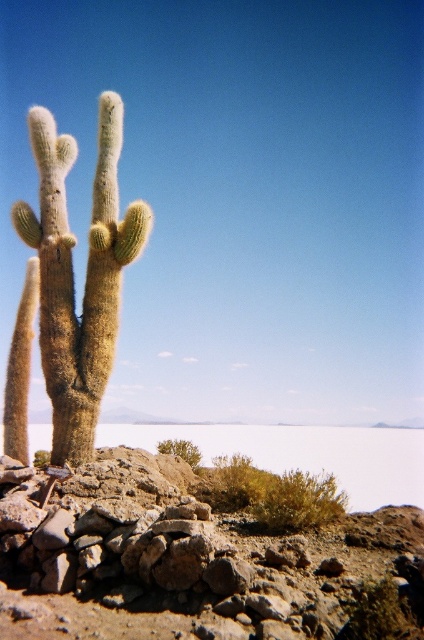
Question: Does green fuzzy cactus at left come in front of brown rocky plain at lower center?

Choices:
 (A) yes
 (B) no

Answer: (B)

Question: Among these points, which one is farthest from the camera?

Choices:
 (A) (x=284, y=426)
 (B) (x=28, y=125)

Answer: (A)

Question: Which object is farther from the camera taking this photo?

Choices:
 (A) rusty stone boulder at center
 (B) brown rocky plain at lower center
 (C) green fuzzy cactus at left

Answer: (C)

Question: Does green fuzzy cactus at left appear over brown rocky plain at lower center?

Choices:
 (A) no
 (B) yes

Answer: (B)

Question: Which point is farther from the camera taking this photo?

Choices:
 (A) (373, 604)
 (B) (108, 116)
 (C) (236, 438)

Answer: (C)

Question: Is rusty stone boulder at center bigger than green fuzzy cactus at left?

Choices:
 (A) yes
 (B) no

Answer: (A)